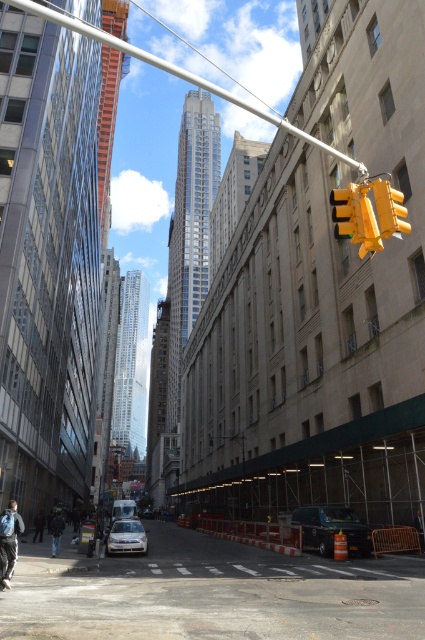
In the scene shown: Is metallic silver pole at upper center bigger than yellow plastic traffic light at upper right?

Yes, metallic silver pole at upper center is bigger than yellow plastic traffic light at upper right.

Which is more to the right, metallic silver pole at upper center or yellow plastic traffic light at upper right?

yellow plastic traffic light at upper right

Between point (263, 113) and point (396, 209), which one is positioned behind?

The point (263, 113) is behind.

I want to click on metallic silver pole at upper center, so click(173, 72).

Who is shorter, metallic silver pole at upper center or black rubber van at lower center?

black rubber van at lower center

Can you confirm if metallic silver pole at upper center is bigger than black rubber van at lower center?

Correct, metallic silver pole at upper center is larger in size than black rubber van at lower center.

Is point (156, 58) behind point (350, 528)?

Yes, it is.

At what (x,y) coordinates should I click in order to perform the action: click on metallic silver pole at upper center. Please return your answer as a coordinate pair (x, y). The height and width of the screenshot is (640, 425). Looking at the image, I should click on (173, 72).

Is black rubber van at lower center in front of silver metallic sedan at center?

Yes, it is.

Which is in front, point (328, 508) or point (124, 532)?

Point (328, 508)

Identify the location of black rubber van at lower center. This screenshot has width=425, height=640. (331, 529).

Where is `black rubber van at lower center`? black rubber van at lower center is located at coordinates (331, 529).